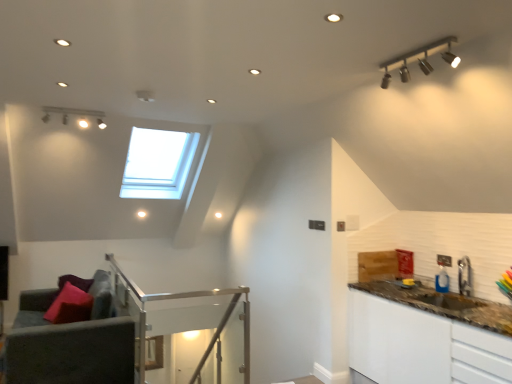
This screenshot has height=384, width=512. What do you see at coordinates (172, 299) in the screenshot?
I see `clear glass balustrade at center` at bounding box center [172, 299].

Where is `matte pink pillow at lower left`? Image resolution: width=512 pixels, height=384 pixels. matte pink pillow at lower left is located at coordinates (70, 306).

What is the approximate width of velvet grey armchair at lower left?

velvet grey armchair at lower left is 1.06 meters wide.

The width and height of the screenshot is (512, 384). In order to click on clear glass balustrade at center in this screenshot , I will do `click(172, 299)`.

Is matte pink pillow at lower left next to brown granite countertop at right?

Answer: No, matte pink pillow at lower left is not making contact with brown granite countertop at right.

From a real-world perspective, is matte pink pillow at lower left above or below brown granite countertop at right?

matte pink pillow at lower left is situated higher than brown granite countertop at right in the real world.

Would you say brown granite countertop at right is part of matte pink pillow at lower left's contents?

No, matte pink pillow at lower left does not contain brown granite countertop at right.

Identify the location of counter top in front of the matte pink pillow at lower left. The height and width of the screenshot is (384, 512). (423, 330).

You are a GUI agent. You are given a task and a screenshot of the screen. Output one action in this format:
    pyautogui.click(x=<x>, y=<y>)
    Task: Click on the couch that is behind the clear glass balustrade at center
    The height and width of the screenshot is (384, 512).
    Given the screenshot: What is the action you would take?
    pyautogui.click(x=34, y=307)

Between point (248, 367) and point (39, 306), which one is positioned behind?

The point (248, 367) is farther.

Is clear glass balustrade at center at the left side of velvet purple couch at lower left?

No.

Is clear glass balustrade at center surrounding velvet purple couch at lower left?

No, velvet purple couch at lower left is not surrounded by clear glass balustrade at center.

Does matte silver track lights at upper right appear on the left side of metallic silver faucet at right?

Yes.

Can you tell me how much matte silver track lights at upper right and metallic silver faucet at right differ in facing direction?

They differ by 1.21 degrees in their facing directions.

At what (x,y) coordinates should I click in order to perform the action: click on light fixture above the metallic silver faucet at right (from a real-world perspective). Please return your answer as a coordinate pair (x, y). Looking at the image, I should click on (419, 60).

Does matte silver track lights at upper right have a greater height compared to metallic silver faucet at right?

In fact, matte silver track lights at upper right may be shorter than metallic silver faucet at right.

Does velvet grey armchair at lower left turn towards velvet purple couch at lower left?

Yes, velvet grey armchair at lower left is facing velvet purple couch at lower left.

Considering the relative positions of velvet grey armchair at lower left and velvet purple couch at lower left in the image provided, is velvet grey armchair at lower left to the right of velvet purple couch at lower left from the viewer's perspective?

Yes, velvet grey armchair at lower left is to the right of velvet purple couch at lower left.

Do you think velvet grey armchair at lower left is within velvet purple couch at lower left, or outside of it?

velvet grey armchair at lower left lies outside velvet purple couch at lower left.

Considering their positions, is velvet grey armchair at lower left located in front of or behind velvet purple couch at lower left?

velvet grey armchair at lower left is in front of velvet purple couch at lower left.

Is matte silver track lights at upper right inside or outside of clear glass balustrade at center?

matte silver track lights at upper right cannot be found inside clear glass balustrade at center.

From a real-world perspective, is matte silver track lights at upper right located beneath clear glass balustrade at center?

No, from a real-world perspective, matte silver track lights at upper right is not beneath clear glass balustrade at center.

From the image's perspective, who appears lower, matte silver track lights at upper right or clear glass balustrade at center?

clear glass balustrade at center appears lower in the image.

Locate an element on the screen. Image resolution: width=512 pixels, height=384 pixels. balustrade that is below the matte silver track lights at upper right (from the image's perspective) is located at coordinates (172, 299).

Does velvet grey armchair at lower left have a lesser width compared to clear glass balustrade at center?

Incorrect, the width of velvet grey armchair at lower left is not less than that of clear glass balustrade at center.

Is velvet grey armchair at lower left at the right side of clear glass balustrade at center?

In fact, velvet grey armchair at lower left is to the left of clear glass balustrade at center.

Measure the distance from velvet grey armchair at lower left to clear glass balustrade at center.

velvet grey armchair at lower left is 38.15 inches from clear glass balustrade at center.

Considering the points (77, 352) and (245, 370), which point is behind, point (77, 352) or point (245, 370)?

The point (245, 370) is farther.

From the image's perspective, would you say velvet purple couch at lower left is positioned over velvet grey armchair at lower left?

Yes, from the image's perspective, velvet purple couch at lower left is above velvet grey armchair at lower left.

What's the angular difference between velvet purple couch at lower left and velvet grey armchair at lower left's facing directions?

There is a 40.1-degree angle between the facing directions of velvet purple couch at lower left and velvet grey armchair at lower left.

Is velvet purple couch at lower left taller or shorter than velvet grey armchair at lower left?

In the image, velvet purple couch at lower left appears to be shorter than velvet grey armchair at lower left.

Find the location of a particular element. This screenshot has height=384, width=512. pillow on the left of brown granite countertop at right is located at coordinates (70, 306).

Where is `balustrade that is below the velvet purple couch at lower left (from the image's perspective)`? This screenshot has width=512, height=384. balustrade that is below the velvet purple couch at lower left (from the image's perspective) is located at coordinates [172, 299].

Looking at the image, which one is located closer to matte silver track lights at upper right, metallic silver faucet at right or clear glass balustrade at center?

metallic silver faucet at right is positioned closer to the anchor matte silver track lights at upper right.

In the scene shown: From the image, which object appears to be nearer to velvet purple couch at lower left, metallic silver faucet at right or brown granite countertop at right?

Among the two, brown granite countertop at right is located nearer to velvet purple couch at lower left.

Based on their spatial positions, is velvet purple couch at lower left or matte pink pillow at lower left closer to velvet grey armchair at lower left?

matte pink pillow at lower left is closer to velvet grey armchair at lower left.

Considering their positions, is matte silver track lights at upper right positioned closer to clear glass balustrade at center than velvet purple couch at lower left?

The object closer to clear glass balustrade at center is velvet purple couch at lower left.

Based on their spatial positions, is velvet grey armchair at lower left or matte pink pillow at lower left further from velvet purple couch at lower left?

velvet grey armchair at lower left is further to velvet purple couch at lower left.

When comparing their distances from matte silver track lights at upper right, does velvet grey armchair at lower left or velvet purple couch at lower left seem closer?

velvet grey armchair at lower left lies closer to matte silver track lights at upper right than the other object.

In the scene shown: Considering their positions, is clear glass balustrade at center positioned closer to velvet grey armchair at lower left than matte pink pillow at lower left?

matte pink pillow at lower left.

Looking at this image, looking at the image, which one is located closer to clear glass balustrade at center, matte silver track lights at upper right or matte pink pillow at lower left?

matte pink pillow at lower left is positioned closer to the anchor clear glass balustrade at center.

Where is `light fixture between velvet purple couch at lower left and metallic silver faucet at right from left to right`? The image size is (512, 384). light fixture between velvet purple couch at lower left and metallic silver faucet at right from left to right is located at coordinates (419, 60).

The width and height of the screenshot is (512, 384). Identify the location of pillow between velvet grey armchair at lower left and metallic silver faucet at right. (70, 306).

Where is `tap between matte silver track lights at upper right and brown granite countertop at right in the vertical direction`? This screenshot has height=384, width=512. tap between matte silver track lights at upper right and brown granite countertop at right in the vertical direction is located at coordinates (465, 276).

Where is `light fixture located between velvet grey armchair at lower left and brown granite countertop at right in the left-right direction`? The height and width of the screenshot is (384, 512). light fixture located between velvet grey armchair at lower left and brown granite countertop at right in the left-right direction is located at coordinates (419, 60).